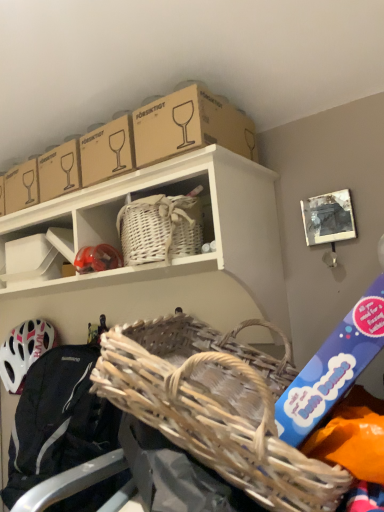
Question: From the image's perspective, is woven natural picnic basket at center located above woven fabric basket at lower left?

Choices:
 (A) no
 (B) yes

Answer: (B)

Question: From a real-world perspective, is woven natural picnic basket at center physically above woven fabric basket at lower left?

Choices:
 (A) no
 (B) yes

Answer: (B)

Question: Does woven natural picnic basket at center have a lesser width compared to woven fabric basket at lower left?

Choices:
 (A) yes
 (B) no

Answer: (B)

Question: Is woven natural picnic basket at center shorter than woven fabric basket at lower left?

Choices:
 (A) no
 (B) yes

Answer: (B)

Question: From the image's perspective, would you say woven natural picnic basket at center is shown under woven fabric basket at lower left?

Choices:
 (A) no
 (B) yes

Answer: (A)

Question: Is point (135, 185) positioned closer to the camera than point (100, 267)?

Choices:
 (A) farther
 (B) closer

Answer: (B)

Question: From their relative heights in the image, would you say white wicker basket at upper center is taller or shorter than matte red helmet at center?

Choices:
 (A) tall
 (B) short

Answer: (A)

Question: From a real-world perspective, relative to matte red helmet at center, is white wicker basket at upper center vertically above or below?

Choices:
 (A) below
 (B) above

Answer: (B)

Question: Is white wicker basket at upper center to the left or to the right of matte red helmet at center in the image?

Choices:
 (A) right
 (B) left

Answer: (B)

Question: Considering the positions of white matte helmet at lower left and woven fabric basket at lower left in the image, is white matte helmet at lower left wider or thinner than woven fabric basket at lower left?

Choices:
 (A) thin
 (B) wide

Answer: (A)

Question: Based on their positions, is white matte helmet at lower left located to the left or right of woven fabric basket at lower left?

Choices:
 (A) right
 (B) left

Answer: (B)

Question: Is white matte helmet at lower left inside or outside of woven fabric basket at lower left?

Choices:
 (A) inside
 (B) outside

Answer: (B)

Question: From their relative heights in the image, would you say white matte helmet at lower left is taller or shorter than woven fabric basket at lower left?

Choices:
 (A) short
 (B) tall

Answer: (A)

Question: From their relative heights in the image, would you say brown cardboard box at upper center is taller or shorter than woven natural picnic basket at center?

Choices:
 (A) tall
 (B) short

Answer: (B)

Question: Is point [188, 96] closer or farther from the camera than point [294, 467]?

Choices:
 (A) farther
 (B) closer

Answer: (A)